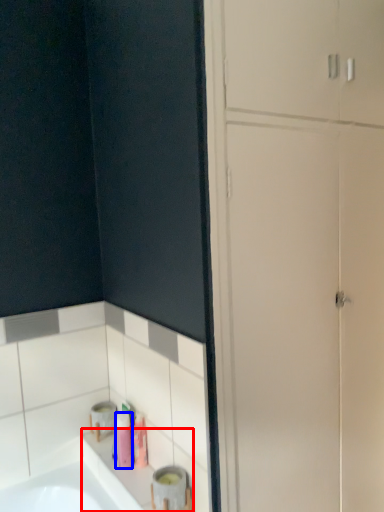
Question: Which of the following is the farthest to the observer, counter top (highlighted by a red box) or toiletry (highlighted by a blue box)?

Choices:
 (A) counter top
 (B) toiletry

Answer: (B)